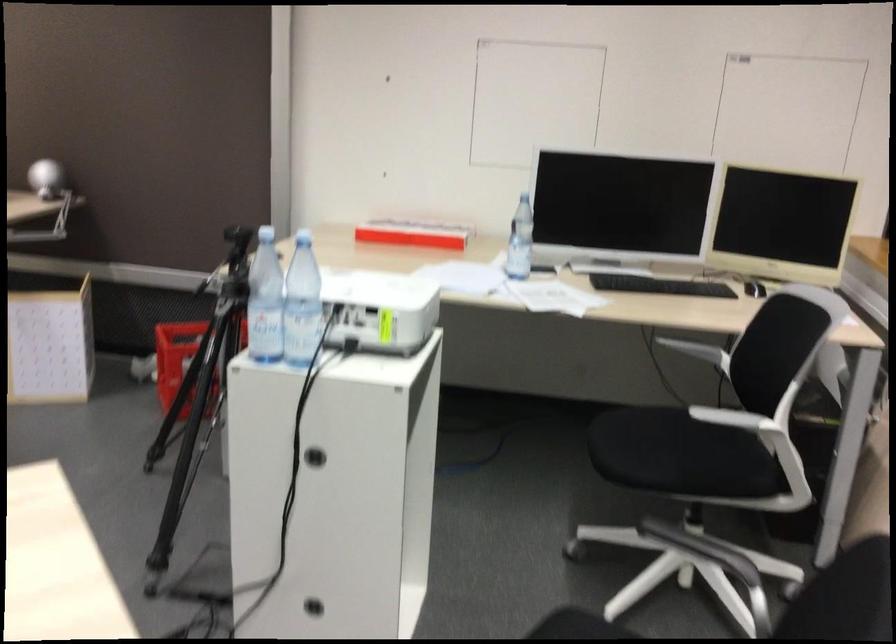
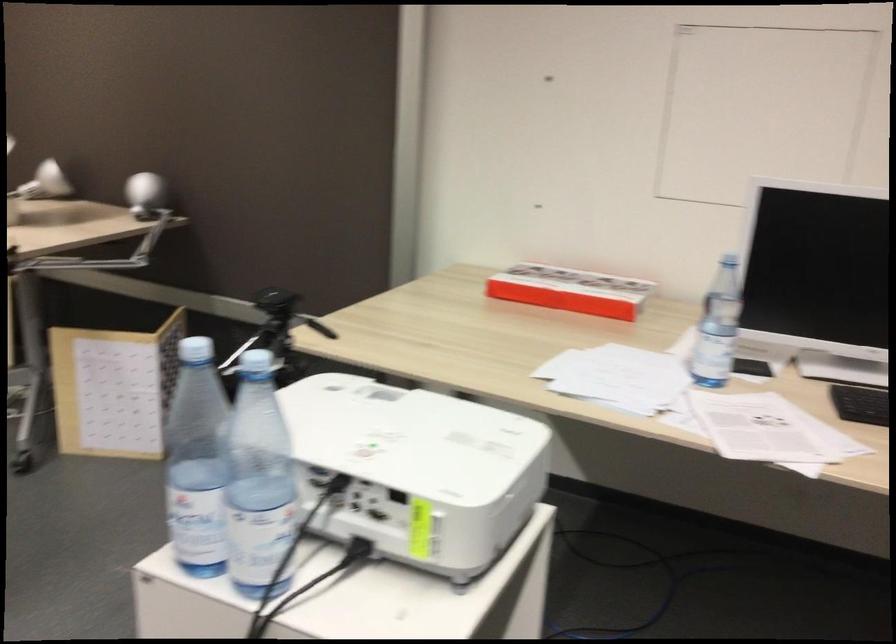
Question: The images are taken continuously from a first-person perspective. In which direction are you moving?

Choices:
 (A) Left
 (B) Right
 (C) Forward
 (D) Backward

Answer: (C)